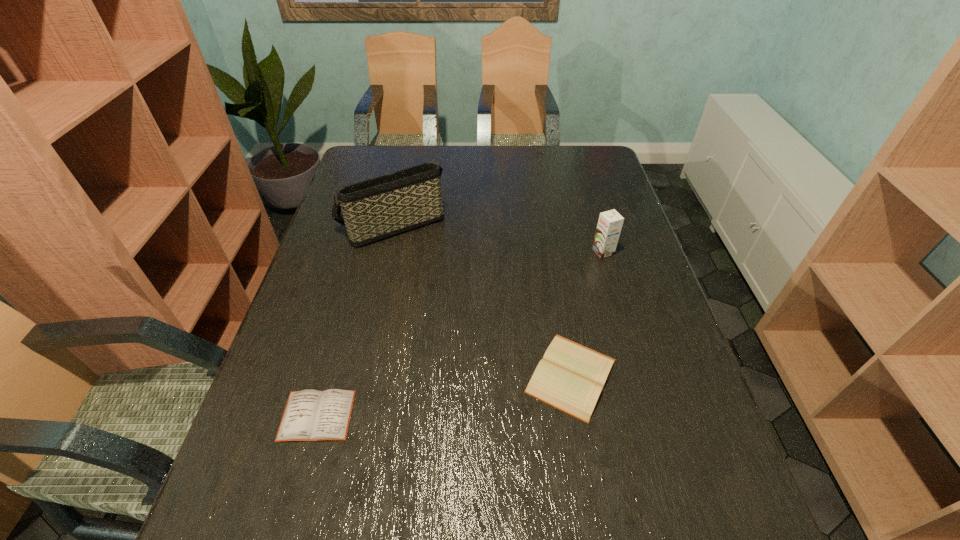
Locate an element on the screen. free space located 0.270m on the back of the shorter diary is located at coordinates (350, 298).

The image size is (960, 540). In order to click on handbag present at the left edge in this screenshot , I will do [x=374, y=209].

You are a GUI agent. You are given a task and a screenshot of the screen. Output one action in this format:
    pyautogui.click(x=<x>, y=<y>)
    Task: Click on the diary positioned at the left edge
    This screenshot has height=540, width=960.
    Given the screenshot: What is the action you would take?
    pyautogui.click(x=310, y=415)

Where is `chocolate milk that is at the right edge`? chocolate milk that is at the right edge is located at coordinates (610, 222).

Where is `diary at the right edge`? The image size is (960, 540). diary at the right edge is located at coordinates (571, 377).

In the image, there is a desktop. At what (x,y) coordinates should I click in order to perform the action: click on vacant space at the far edge. Please return your answer as a coordinate pair (x, y). Looking at the image, I should click on 533,168.

Locate an element on the screen. vacant space at the left edge is located at coordinates (323, 269).

This screenshot has height=540, width=960. I want to click on vacant space at the right edge of the desktop, so click(x=618, y=206).

Find the location of `vacant region at the far left corner`. vacant region at the far left corner is located at coordinates (366, 168).

The image size is (960, 540). I want to click on vacant space at the far right corner of the desktop, so click(x=564, y=150).